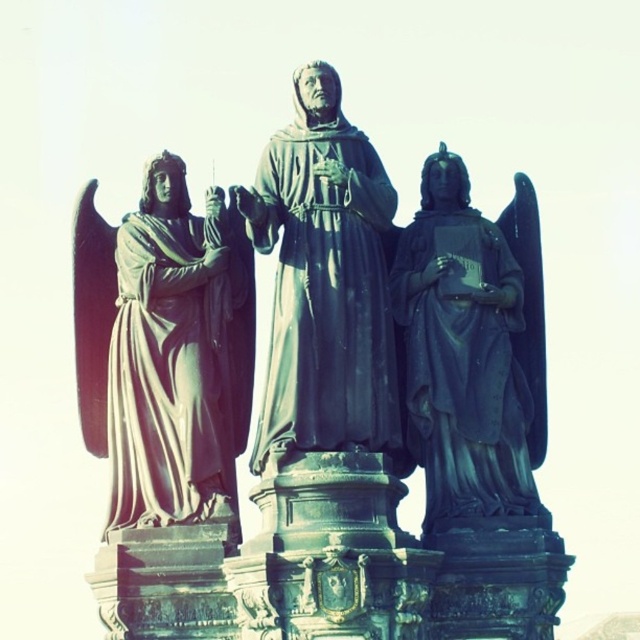
How distant is matte black statue at right from bronze statue at center?

The distance of matte black statue at right from bronze statue at center is 5.76 meters.

Does matte black statue at right have a greater width compared to bronze statue at center?

No, matte black statue at right is not wider than bronze statue at center.

Where is `matte black statue at right`? The height and width of the screenshot is (640, 640). matte black statue at right is located at coordinates (472, 348).

Is point (152, 420) more distant than point (336, 358)?

Yes, point (152, 420) is farther from viewer.

Between matte bronze statue at left and bronze statue at center, which one is positioned higher?

bronze statue at center is above.

Between point (228, 413) and point (275, 304), which one is positioned behind?

Positioned behind is point (228, 413).

Where is `matte bronze statue at left`? matte bronze statue at left is located at coordinates (179, 355).

How distant is matte black statue at right from matte bronze statue at left?

The distance of matte black statue at right from matte bronze statue at left is 13.45 meters.

Between matte black statue at right and matte bronze statue at left, which one is positioned higher?

matte black statue at right

The image size is (640, 640). I want to click on matte black statue at right, so click(x=472, y=348).

This screenshot has height=640, width=640. What are the coordinates of `matte black statue at right` in the screenshot? It's located at (472, 348).